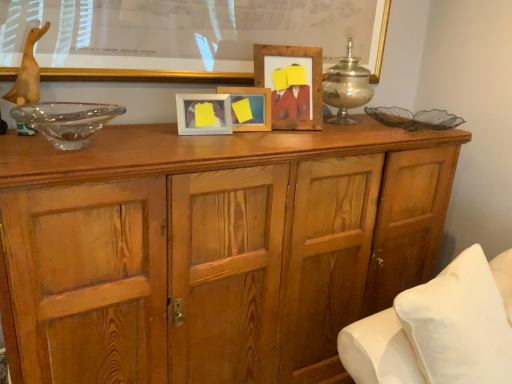
Where is `silver metallic candle holder at upper center`? silver metallic candle holder at upper center is located at coordinates (346, 87).

Identify the location of wooden frame at upper center. The image size is (512, 384). (143, 75).

Image resolution: width=512 pixels, height=384 pixels. What do you see at coordinates (459, 323) in the screenshot?
I see `white soft pillow at lower right` at bounding box center [459, 323].

Measure the distance between white soft pillow at lower right and camera.

white soft pillow at lower right is 3.69 feet away from camera.

Identify the location of silver metallic candle holder at upper center. This screenshot has width=512, height=384. (346, 87).

From a real-world perspective, who is located lower, wooden frame at upper center or wooden picture frame at center, which ranks as the 1th picture frame in right-to-left order?

wooden picture frame at center, which ranks as the 1th picture frame in right-to-left order, from a real-world perspective.

Does wooden frame at upper center have a greater width compared to wooden picture frame at center, which ranks as the 3th picture frame in left-to-right order?

In fact, wooden frame at upper center might be narrower than wooden picture frame at center, which ranks as the 3th picture frame in left-to-right order.

From the picture: Who is smaller, wooden frame at upper center or wooden picture frame at center, which ranks as the 3th picture frame in left-to-right order?

Smaller between the two is wooden picture frame at center, which ranks as the 3th picture frame in left-to-right order.

Is wooden frame at upper center not within wooden picture frame at center, which ranks as the 1th picture frame in right-to-left order?

Indeed, wooden frame at upper center is completely outside wooden picture frame at center, which ranks as the 1th picture frame in right-to-left order.

Is point (96, 70) positioned in front of point (460, 279)?

No, it is behind (460, 279).

Between wooden frame at upper center and white soft pillow at lower right, which one has smaller size?

wooden frame at upper center is smaller.

Is wooden frame at upper center positioned with its back to white soft pillow at lower right?

No, wooden frame at upper center's orientation is not away from white soft pillow at lower right.

Is wooden frame at upper center situated inside white soft pillow at lower right or outside?

wooden frame at upper center is not enclosed by white soft pillow at lower right.

Is wooden frame at upper center to the left or to the right of matte wooden picture frame at center, acting as the first picture frame starting from the left, in the image?

In the image, wooden frame at upper center appears on the right side of matte wooden picture frame at center, acting as the first picture frame starting from the left.

From their relative heights in the image, would you say wooden frame at upper center is taller or shorter than matte wooden picture frame at center, the third picture frame positioned from the right?

Clearly, wooden frame at upper center is taller compared to matte wooden picture frame at center, the third picture frame positioned from the right.

Which is behind, wooden frame at upper center or matte wooden picture frame at center, acting as the first picture frame starting from the left?

matte wooden picture frame at center, acting as the first picture frame starting from the left, is more distant.

Identify the location of bulletin board located above the wooden photo frame at center, which is the second picture frame in right-to-left order (from the image's perspective). This screenshot has height=384, width=512. (143, 75).

Considering the sizes of objects wooden photo frame at center, which is the second picture frame in right-to-left order, and wooden frame at upper center in the image provided, who is wider, wooden photo frame at center, which is the second picture frame in right-to-left order, or wooden frame at upper center?

Wider between the two is wooden frame at upper center.

In the scene shown: Which of these two, wooden photo frame at center, which is the second picture frame in right-to-left order, or wooden frame at upper center, is bigger?

With larger size is wooden frame at upper center.

Is wooden photo frame at center, which is the second picture frame in right-to-left order, looking in the opposite direction of wooden frame at upper center?

That's not correct — wooden photo frame at center, which is the second picture frame in right-to-left order, is not looking away from wooden frame at upper center.

Considering the sizes of objects transparent glass bowl at left and wooden cabinet at center in the image provided, who is smaller, transparent glass bowl at left or wooden cabinet at center?

Smaller between the two is transparent glass bowl at left.

Considering the relative sizes of transparent glass bowl at left and wooden cabinet at center in the image provided, is transparent glass bowl at left taller than wooden cabinet at center?

Incorrect, the height of transparent glass bowl at left is not larger of that of wooden cabinet at center.

From the image's perspective, relative to wooden cabinet at center, is transparent glass bowl at left above or below?

From the image's perspective, transparent glass bowl at left appears above wooden cabinet at center.

Would you consider matte wooden picture frame at center, the third picture frame positioned from the right, to be distant from silver metallic candle holder at upper center?

Actually, matte wooden picture frame at center, the third picture frame positioned from the right, and silver metallic candle holder at upper center are a little close together.

Is matte wooden picture frame at center, the third picture frame positioned from the right, positioned beyond the bounds of silver metallic candle holder at upper center?

Indeed, matte wooden picture frame at center, the third picture frame positioned from the right, is completely outside silver metallic candle holder at upper center.

How different are the orientations of matte wooden picture frame at center, acting as the first picture frame starting from the left, and silver metallic candle holder at upper center in degrees?

They differ by 10.6 degrees in their facing directions.

Is matte wooden picture frame at center, acting as the first picture frame starting from the left, further to camera compared to silver metallic candle holder at upper center?

No, matte wooden picture frame at center, acting as the first picture frame starting from the left, is closer to the camera.

How many degrees apart are the facing directions of white soft pillow at lower right and silver metallic candle holder at upper center?

There is a 11.1-degree angle between the facing directions of white soft pillow at lower right and silver metallic candle holder at upper center.

From a real-world perspective, which object rests below the other?

white soft pillow at lower right is physically lower.

Looking at the image, does white soft pillow at lower right seem bigger or smaller compared to silver metallic candle holder at upper center?

Considering their sizes, white soft pillow at lower right takes up more space than silver metallic candle holder at upper center.

Does point (434, 344) lie in front of point (342, 100)?

Yes, it is.

What are the coordinates of `bulletin board in front of the wooden picture frame at center, which ranks as the 3th picture frame in left-to-right order` in the screenshot? It's located at (143, 75).

Identify the location of pillow below the wooden frame at upper center (from the image's perspective). (459, 323).

Based on their spatial positions, is matte wooden picture frame at center, acting as the first picture frame starting from the left, or wooden frame at upper center closer to white soft pillow at lower right?

Among the two, matte wooden picture frame at center, acting as the first picture frame starting from the left, is located nearer to white soft pillow at lower right.

Based on their spatial positions, is wooden cabinet at center or wooden picture frame at center, which ranks as the 1th picture frame in right-to-left order, closer to transparent glass bowl at left?

wooden cabinet at center lies closer to transparent glass bowl at left than the other object.

When comparing their distances from wooden photo frame at center, which is the second picture frame in right-to-left order, does wooden picture frame at center, which ranks as the 3th picture frame in left-to-right order, or wooden frame at upper center seem further?

wooden frame at upper center is positioned further to the anchor wooden photo frame at center, which is the second picture frame in right-to-left order.

Looking at the image, which one is located closer to white soft pillow at lower right, wooden frame at upper center or wooden photo frame at center, placed as the 2th picture frame when sorted from left to right?

wooden photo frame at center, placed as the 2th picture frame when sorted from left to right.

When comparing their distances from transparent glass bowl at left, does matte wooden picture frame at center, acting as the first picture frame starting from the left, or wooden photo frame at center, placed as the 2th picture frame when sorted from left to right, seem closer?

matte wooden picture frame at center, acting as the first picture frame starting from the left, lies closer to transparent glass bowl at left than the other object.

When comparing their distances from white soft pillow at lower right, does transparent glass bowl at left or wooden frame at upper center seem closer?

transparent glass bowl at left lies closer to white soft pillow at lower right than the other object.

From the image, which object appears to be nearer to white soft pillow at lower right, wooden cabinet at center or wooden photo frame at center, placed as the 2th picture frame when sorted from left to right?

wooden cabinet at center is closer to white soft pillow at lower right.

Estimate the real-world distances between objects in this image. Which object is closer to silver metallic candle holder at upper center, transparent glass bowl at left or white soft pillow at lower right?

The object closer to silver metallic candle holder at upper center is white soft pillow at lower right.

Where is `picture frame located between transparent glass bowl at left and wooden photo frame at center, which is the second picture frame in right-to-left order, in the left-right direction`? picture frame located between transparent glass bowl at left and wooden photo frame at center, which is the second picture frame in right-to-left order, in the left-right direction is located at coordinates (203, 114).

You are a GUI agent. You are given a task and a screenshot of the screen. Output one action in this format:
    pyautogui.click(x=<x>, y=<y>)
    Task: Click on the glass bowl between wooden photo frame at center, placed as the 2th picture frame when sorted from left to right, and wooden cabinet at center, in the vertical direction
    The width and height of the screenshot is (512, 384).
    Given the screenshot: What is the action you would take?
    pyautogui.click(x=67, y=121)

Find the location of a particular element. cabinetry between silver metallic candle holder at upper center and white soft pillow at lower right from top to bottom is located at coordinates (213, 248).

Locate an element on the screen. This screenshot has height=384, width=512. picture frame between matte wooden picture frame at center, acting as the first picture frame starting from the left, and wooden picture frame at center, which ranks as the 3th picture frame in left-to-right order is located at coordinates tap(246, 96).